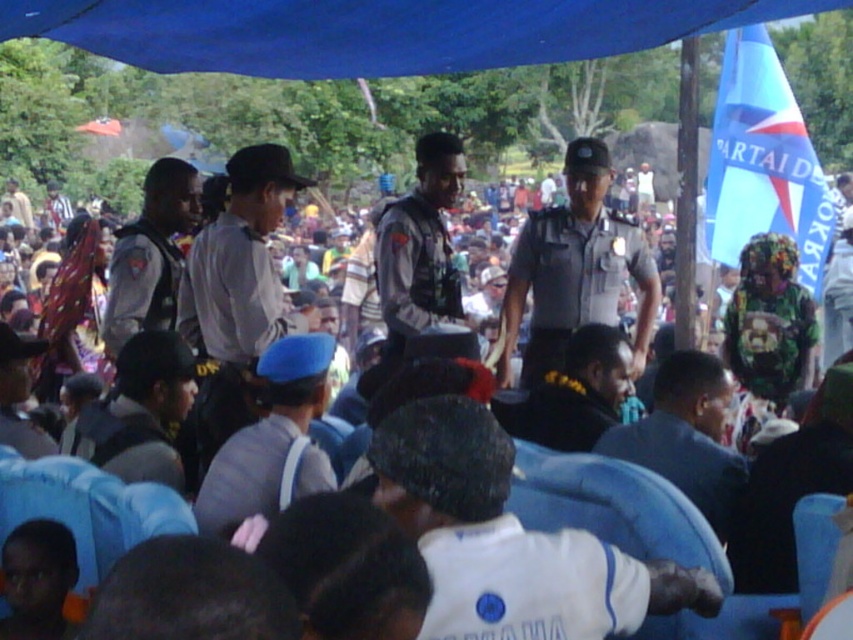
You are a photographer trying to capture a clear shot of the black fabric headband at center without the blue fabric canopy at upper center blocking the view. Can you lower your camera position to achieve this?

The blue fabric canopy at upper center has a lesser height compared to black fabric headband at center. Lowering your camera position might not help because the canopy is shorter than the headband, so it might still block the view. Alternatively, moving closer to the headband could allow you to frame the shot without the canopy obstructing.

You are a photographer at the event and need to capture a clear photo of both the white shirt at center and the black fabric headband at center. Which object will appear larger in the photo?

The black fabric headband at center will appear larger in the photo because it is bigger than the white shirt at center.